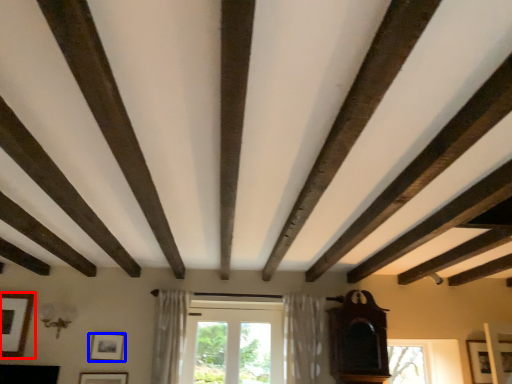
Question: Among these objects, which one is nearest to the camera, picture frame (highlighted by a red box) or picture frame (highlighted by a blue box)?

Choices:
 (A) picture frame
 (B) picture frame

Answer: (A)